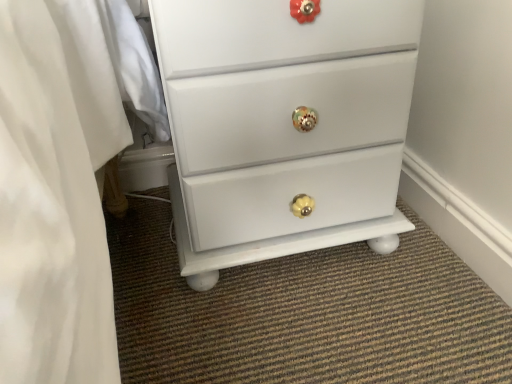
The image size is (512, 384). What do you see at coordinates (284, 126) in the screenshot?
I see `white glossy chest of drawers at center` at bounding box center [284, 126].

The height and width of the screenshot is (384, 512). Identify the location of white glossy chest of drawers at center. (284, 126).

Where is `white glossy chest of drawers at center`? Image resolution: width=512 pixels, height=384 pixels. white glossy chest of drawers at center is located at coordinates (284, 126).